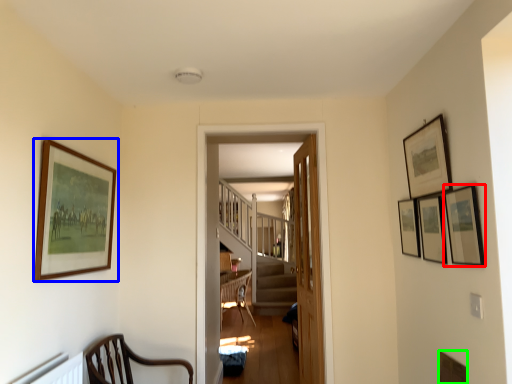
Question: Which object is positioned farthest from picture frame (highlighted by a red box)? Select from picture frame (highlighted by a blue box) and picture frame (highlighted by a green box).

Choices:
 (A) picture frame
 (B) picture frame

Answer: (A)